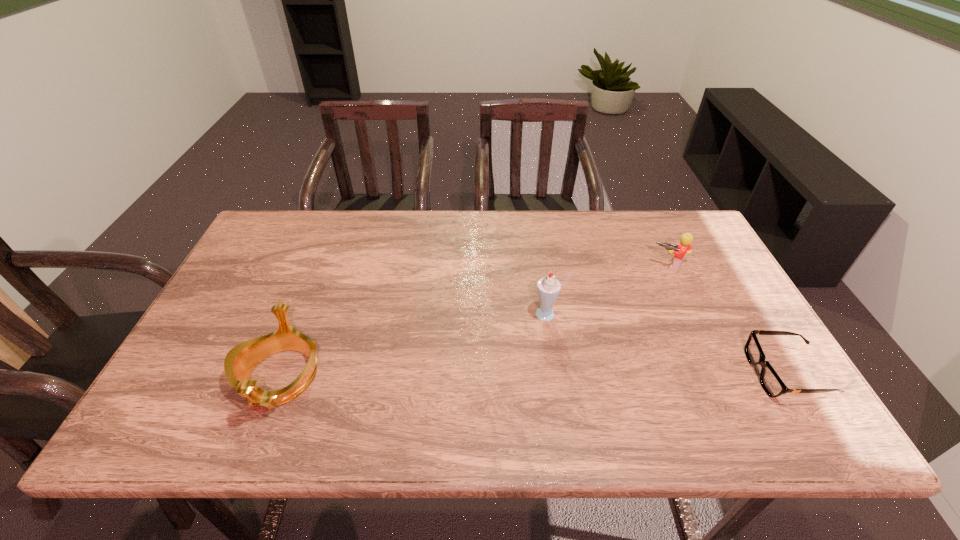
Where is `free point between the shortest object and the third object from left to right`? This screenshot has height=540, width=960. free point between the shortest object and the third object from left to right is located at coordinates (728, 320).

Locate an element on the screen. The height and width of the screenshot is (540, 960). vacant space in between the shortest object and the leftmost object is located at coordinates (533, 375).

Find the location of `free space that is in between the sunglasses and the leftmost object`. free space that is in between the sunglasses and the leftmost object is located at coordinates (533, 375).

You are a GUI agent. You are given a task and a screenshot of the screen. Output one action in this format:
    pyautogui.click(x=<x>, y=<y>)
    Task: Click on the free area in between the tiara and the tallest object
    The width and height of the screenshot is (960, 540).
    Given the screenshot: What is the action you would take?
    pyautogui.click(x=415, y=346)

Locate an element on the screen. free spot between the Lego and the sunglasses is located at coordinates (728, 320).

I want to click on free space between the farthest object and the second farthest object, so click(609, 290).

This screenshot has height=540, width=960. I want to click on empty space between the leftmost object and the Lego, so click(x=474, y=322).

At what (x,y) coordinates should I click in order to perform the action: click on free area in between the tiara and the Lego. Please return your answer as a coordinate pair (x, y). This screenshot has width=960, height=540. Looking at the image, I should click on 474,322.

Find the location of `object that stands as the closest to the tiara`. object that stands as the closest to the tiara is located at coordinates (548, 288).

Identify the location of object that stands as the second closest to the rightmost object. Image resolution: width=960 pixels, height=540 pixels. (548, 288).